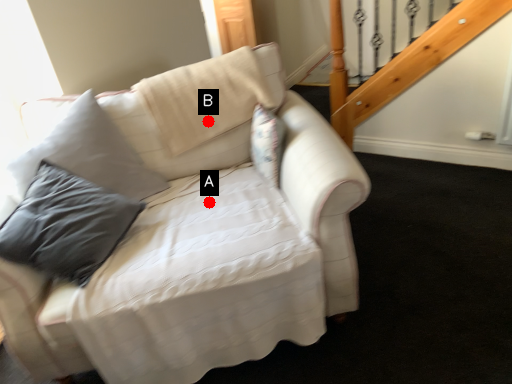
Question: Two points are circled on the image, labeled by A and B beside each circle. Which point is closer to the camera?

Choices:
 (A) A is closer
 (B) B is closer

Answer: (A)